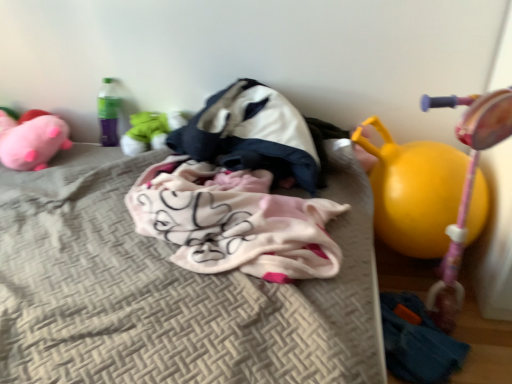
Question: From the image's perspective, is yellow rubber ball at right positioned above or below white and navy blue fabric sleeping bag at center?

Choices:
 (A) below
 (B) above

Answer: (A)

Question: In terms of size, does yellow rubber ball at right appear bigger or smaller than white and navy blue fabric sleeping bag at center?

Choices:
 (A) big
 (B) small

Answer: (A)

Question: Which is farther from the soft plush toy at center, the 2th toy in the right-to-left sequence?

Choices:
 (A) pink plush toy at left, the 1th toy in the left-to-right sequence
 (B) fluffy pink blanket at center
 (C) yellow rubber ball at right
 (D) beige textured mattress at center
 (E) yellow rubber ball at right, the 3th toy when ordered from left to right

Answer: (C)

Question: Which is farther from the yellow rubber ball at right?

Choices:
 (A) pink plush toy at left, the 1th toy in the left-to-right sequence
 (B) white and navy blue fabric sleeping bag at center
 (C) fluffy pink blanket at center
 (D) beige textured mattress at center
 (E) soft plush toy at center, the 2th toy in the right-to-left sequence

Answer: (A)